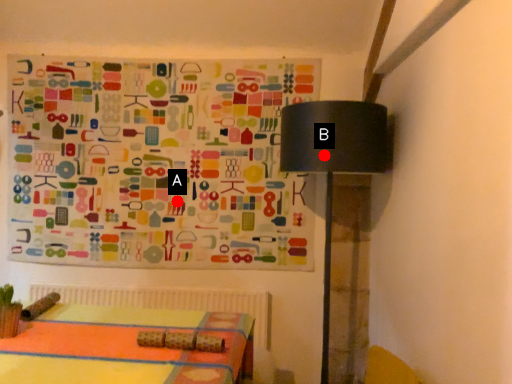
Question: Two points are circled on the image, labeled by A and B beside each circle. Which point appears closest to the camera in this image?

Choices:
 (A) A is closer
 (B) B is closer

Answer: (B)